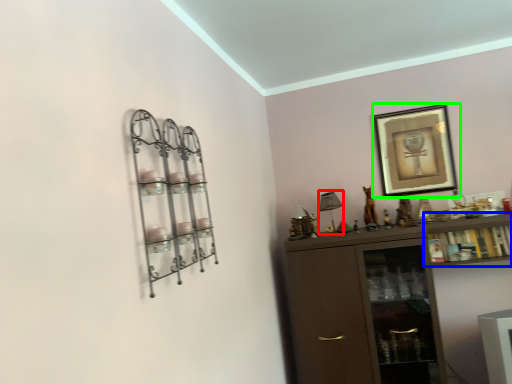
Question: Which is nearer to the lamp (highlighted by a red box)? cabinet (highlighted by a blue box) or picture frame (highlighted by a green box).

Choices:
 (A) cabinet
 (B) picture frame

Answer: (B)